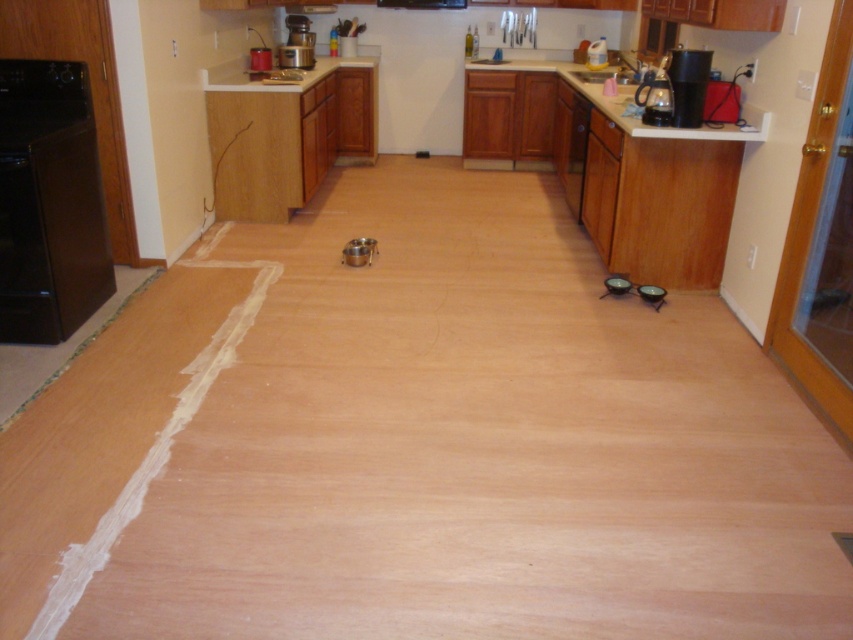
Identify the location of white laminate counter top at upper center. (277, 74).

At what (x,y) coordinates should I click in order to perform the action: click on white laminate counter top at upper center. Please return your answer as a coordinate pair (x, y). This screenshot has height=640, width=853. Looking at the image, I should click on [277, 74].

Is white laminate counter top at upper center below satin silver toaster at upper center?

Yes.

Who is positioned more to the right, white laminate counter top at upper center or satin silver toaster at upper center?

Positioned to the right is white laminate counter top at upper center.

At what (x,y) coordinates should I click in order to perform the action: click on white laminate counter top at upper center. Please return your answer as a coordinate pair (x, y). Looking at the image, I should click on (277, 74).

Image resolution: width=853 pixels, height=640 pixels. Identify the location of white laminate counter top at upper center. (277, 74).

Can you confirm if black matte oven at left is positioned below black plastic kettle at upper right?

Yes.

Which is in front, point (70, 260) or point (656, 106)?

Point (70, 260) is more forward.

Describe the element at coordinates (49, 204) in the screenshot. The image size is (853, 640). I see `black matte oven at left` at that location.

Find the location of `black matte oven at left`. black matte oven at left is located at coordinates (49, 204).